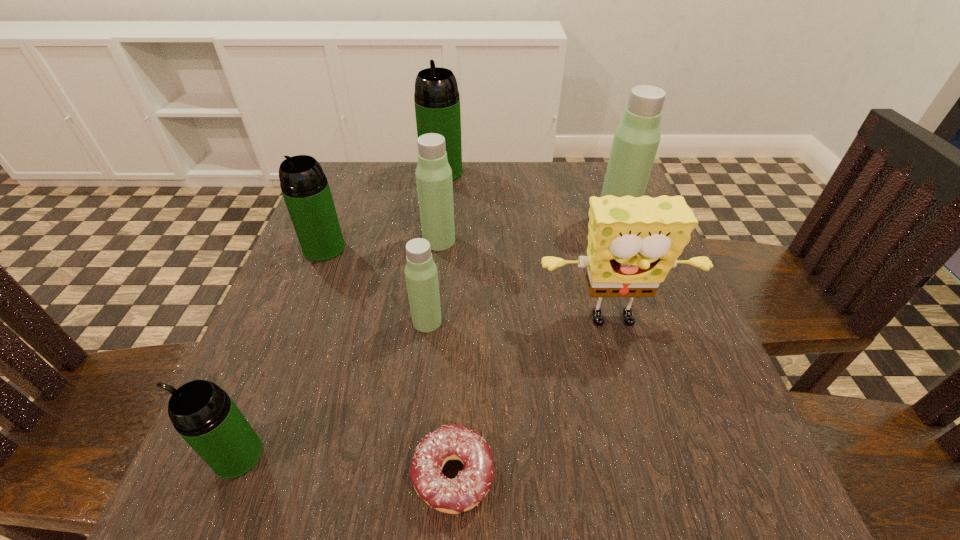
In the image, there is a desktop. Where is `free region at the near left corner`? The width and height of the screenshot is (960, 540). free region at the near left corner is located at coordinates (290, 478).

Find the location of a particular element. free space at the near right corner of the desktop is located at coordinates (739, 514).

You are a GUI agent. You are given a task and a screenshot of the screen. Output one action in this format:
    pyautogui.click(x=<x>, y=<y>)
    Task: Click on the free spot between the yellow sponge and the second smallest light thermos bottle
    Image resolution: width=960 pixels, height=540 pixels.
    Given the screenshot: What is the action you would take?
    pyautogui.click(x=526, y=282)

Locate an element on the screen. The image size is (960, 540). unoccupied position between the nearest thermos bottle and the sponge is located at coordinates (425, 389).

Find the location of `free space between the shortest object and the smallest light thermos bottle`. free space between the shortest object and the smallest light thermos bottle is located at coordinates (441, 398).

Locate an element on the screen. The height and width of the screenshot is (540, 960). vacant region between the second smallest light thermos bottle and the yellow sponge is located at coordinates (526, 282).

Where is `free space between the yellow sponge and the doughnut`? Image resolution: width=960 pixels, height=540 pixels. free space between the yellow sponge and the doughnut is located at coordinates (533, 399).

What are the coordinates of `free area in between the farthest object and the second nearest green thermos bottle` in the screenshot? It's located at pos(383,210).

Locate an element on the screen. vacant area that lies between the smallest green thermos bottle and the rightmost green thermos bottle is located at coordinates (340, 314).

You are a GUI agent. You are given a task and a screenshot of the screen. Output one action in this format:
    pyautogui.click(x=<x>, y=<y>)
    Task: Click on the vacant space that's between the second smallest green thermos bottle and the nearest green thermos bottle
    Image resolution: width=960 pixels, height=540 pixels.
    Given the screenshot: What is the action you would take?
    pyautogui.click(x=281, y=352)